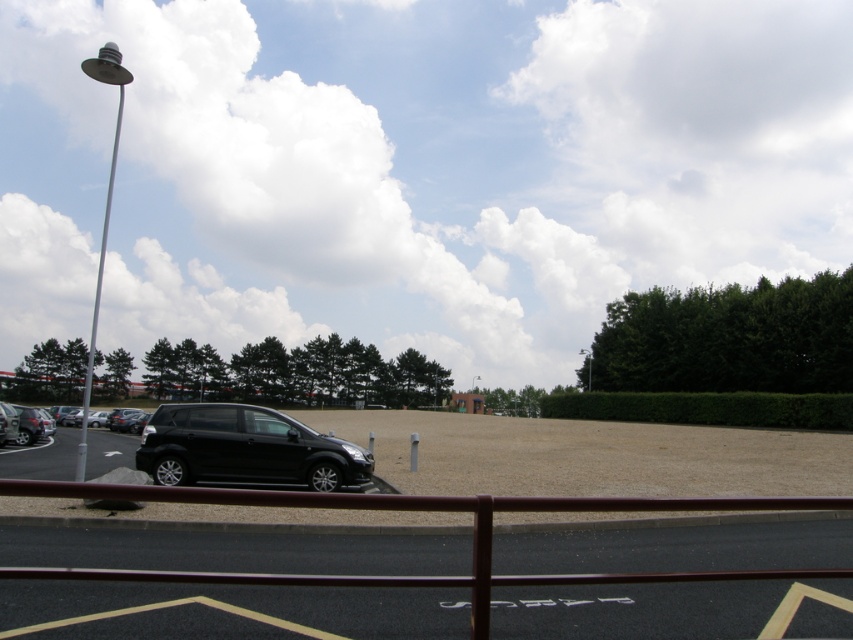
Can you confirm if black asphalt parking lot at lower center is positioned above black matte car at lower left?

Indeed, black asphalt parking lot at lower center is positioned over black matte car at lower left.

Does black asphalt parking lot at lower center have a lesser width compared to black matte car at lower left?

Yes.

Measure the distance between black asphalt parking lot at lower center and camera.

The distance of black asphalt parking lot at lower center from camera is 17.63 feet.

Find the location of a particular element. This screenshot has width=853, height=640. black asphalt parking lot at lower center is located at coordinates (234, 550).

Does point (671, 547) lie in front of point (258, 470)?

Yes, point (671, 547) is in front of point (258, 470).

Which is below, black asphalt parking lot at lower center or black matte suv at center?

Positioned lower is black matte suv at center.

Describe the element at coordinates (234, 550) in the screenshot. The height and width of the screenshot is (640, 853). I see `black asphalt parking lot at lower center` at that location.

Locate an element on the screen. The width and height of the screenshot is (853, 640). black asphalt parking lot at lower center is located at coordinates (234, 550).

Which is more to the right, black matte suv at center or shiny black suv at left?

From the viewer's perspective, black matte suv at center appears more on the right side.

Which of these two, black matte suv at center or shiny black suv at left, stands taller?

shiny black suv at left is taller.

Who is more distant from viewer, (187, 436) or (50, 410)?

The point (50, 410) is more distant.

This screenshot has width=853, height=640. In order to click on black matte suv at center in this screenshot , I will do `click(245, 449)`.